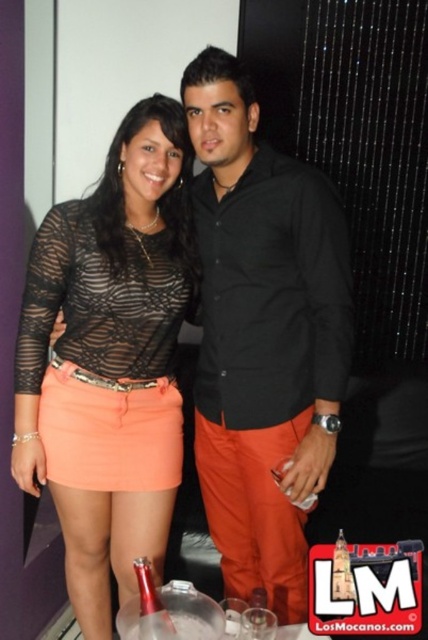
Is black matte shirt at center below metallic silver bottle at center?

No, black matte shirt at center is not below metallic silver bottle at center.

Measure the distance between point (235, 230) and camera.

A distance of 1.52 meters exists between point (235, 230) and camera.

I want to click on black matte shirt at center, so click(262, 337).

Can you confirm if matte black sheer top at center is smaller than metallic silver bottle at center?

No.

Can you confirm if matte black sheer top at center is bigger than metallic silver bottle at center?

Indeed, matte black sheer top at center has a larger size compared to metallic silver bottle at center.

Is point (160, 292) behind point (149, 576)?

Yes, point (160, 292) is farther from viewer.

This screenshot has height=640, width=428. Find the location of `matte black sheer top at center`. matte black sheer top at center is located at coordinates (112, 342).

Can you confirm if black matte shirt at center is shorter than matte black sheer top at center?

Yes, black matte shirt at center is shorter than matte black sheer top at center.

Does black matte shirt at center appear on the left side of matte black sheer top at center?

Incorrect, black matte shirt at center is not on the left side of matte black sheer top at center.

Describe the element at coordinates (262, 337) in the screenshot. I see `black matte shirt at center` at that location.

At what (x,y) coordinates should I click in order to perform the action: click on black matte shirt at center. Please return your answer as a coordinate pair (x, y). The height and width of the screenshot is (640, 428). Looking at the image, I should click on (262, 337).